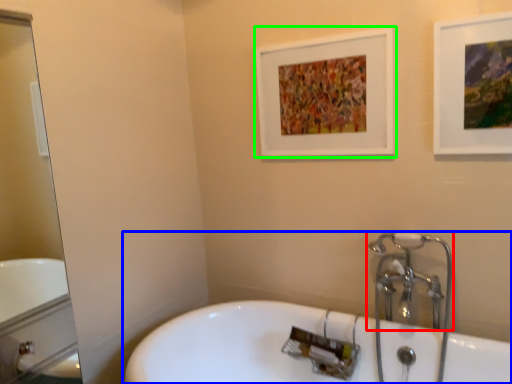
Question: Which object is the closest to the tap (highlighted by a red box)? Choose among these: bathtub (highlighted by a blue box) or picture frame (highlighted by a green box).

Choices:
 (A) bathtub
 (B) picture frame

Answer: (A)